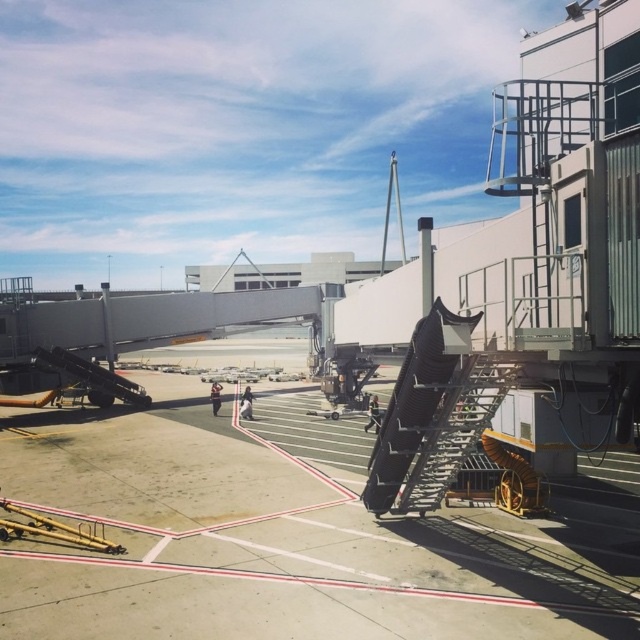
You are a ground crew member standing on the metallic gray tarmac at center and need to reach the top of the metallic staircase at right. Which direction should you move towards to climb the staircase?

The metallic gray tarmac at center is below the metallic staircase at right, so you should move towards the right to climb the staircase.

You are a ground crew member standing on the metallic gray tarmac at center and need to reach the metallic staircase at right. Which direction should you walk to get closer to the staircase?

Since the metallic gray tarmac at center is closer to the viewer than the metallic staircase at right, you should walk towards the direction of the staircase to get closer to it.